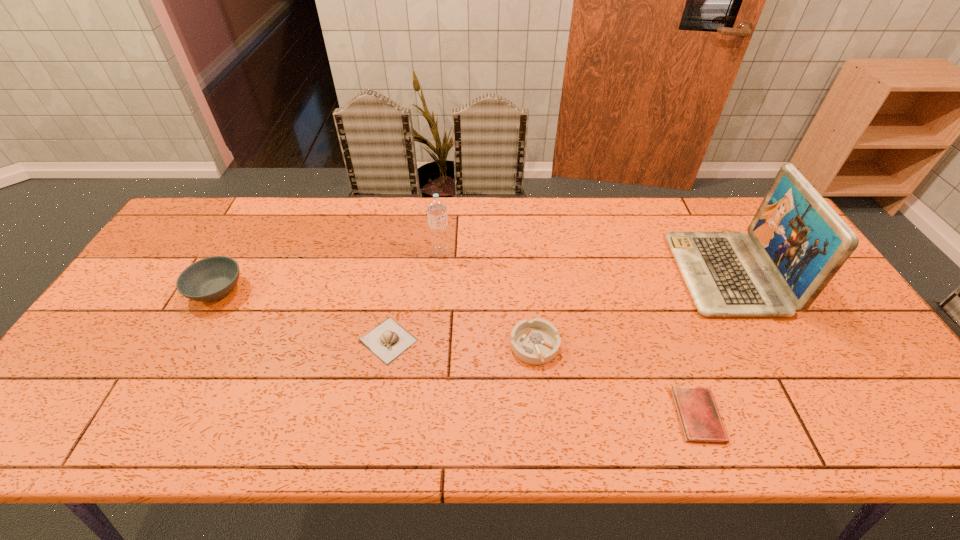
At what (x,y) coordinates should I click in order to perform the action: click on free space that satisfies the following two spatial constraints: 1. on the back side of the water bottle; 2. on the right side of the fourth shortest object. Please return your answer as a coordinate pair (x, y). Looking at the image, I should click on (238, 252).

Where is `vacant area that satisfies the following two spatial constraints: 1. on the screen of the laptop computer; 2. on the front side of the garlic`? The width and height of the screenshot is (960, 540). vacant area that satisfies the following two spatial constraints: 1. on the screen of the laptop computer; 2. on the front side of the garlic is located at coordinates (762, 340).

This screenshot has width=960, height=540. Find the location of `free point that satisfies the following two spatial constraints: 1. on the screen of the rightmost object; 2. on the front side of the shortest object`. free point that satisfies the following two spatial constraints: 1. on the screen of the rightmost object; 2. on the front side of the shortest object is located at coordinates (804, 415).

Where is `vacant space that satisfies the following two spatial constraints: 1. on the front side of the third object from right to left; 2. on the right side of the fifth object from left to right`? This screenshot has width=960, height=540. vacant space that satisfies the following two spatial constraints: 1. on the front side of the third object from right to left; 2. on the right side of the fifth object from left to right is located at coordinates (542, 415).

You are a GUI agent. You are given a task and a screenshot of the screen. Output one action in this format:
    pyautogui.click(x=<x>, y=<y>)
    Task: Click on the vacant position in the image that satisfies the following two spatial constraints: 1. on the front side of the fifth object from right to left; 2. on the left side of the fourth shortest object
    The image size is (960, 540).
    Given the screenshot: What is the action you would take?
    pyautogui.click(x=189, y=340)